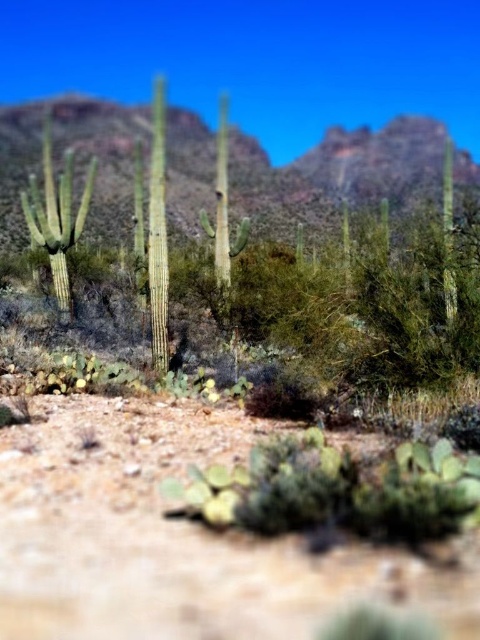
Question: Does brown sandy dirt track at lower center have a lesser width compared to green spiny cactus at left?

Choices:
 (A) yes
 (B) no

Answer: (A)

Question: Can you confirm if brown sandy dirt track at lower center is bigger than green spiny cactus at left?

Choices:
 (A) no
 (B) yes

Answer: (A)

Question: Which point is closer to the camera?

Choices:
 (A) brown sandy dirt track at lower center
 (B) green textured cactus at center

Answer: (A)

Question: Which object is positioned farthest from the brown sandy dirt track at lower center?

Choices:
 (A) green spiny cactus at left
 (B) green textured cactus at center

Answer: (B)

Question: Which point appears closest to the camera in this image?

Choices:
 (A) (71, 161)
 (B) (443, 150)

Answer: (A)

Question: Can you confirm if brown sandy dirt track at lower center is thinner than green spiny cactus at left?

Choices:
 (A) no
 (B) yes

Answer: (B)